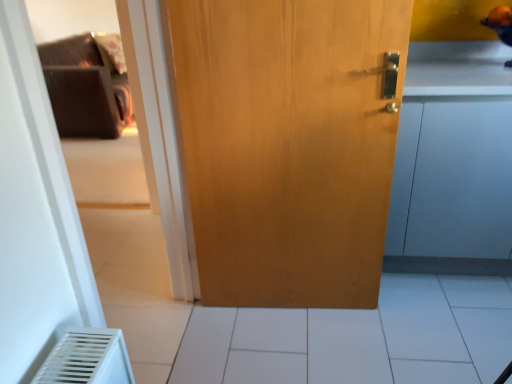
At what (x,y) coordinates should I click in order to perform the action: click on matte wood cabinet at right. Please return your answer as a coordinate pair (x, y). This screenshot has height=384, width=512. Looking at the image, I should click on (453, 162).

Identify the location of light brown wood door at center. The image size is (512, 384). click(289, 145).

Find the location of a particular element. This screenshot has width=512, height=384. tile below the matte wood cabinet at right (from the image's perspective) is located at coordinates (359, 337).

Which object is further away from the camera, white tile at center or matte wood cabinet at right?

matte wood cabinet at right is further away from the camera.

Between point (223, 376) and point (415, 138), which one is positioned behind?

The point (415, 138) is farther.

Between white tile at center and matte wood cabinet at right, which one has larger width?

Wider between the two is white tile at center.

From the image's perspective, which one is positioned lower, matte wood cabinet at right or white tile at center?

white tile at center.

Considering the relative sizes of matte wood cabinet at right and white tile at center in the image provided, is matte wood cabinet at right wider than white tile at center?

No, matte wood cabinet at right is not wider than white tile at center.

Which is closer, [497,268] or [358,380]?

Point [497,268] is farther from the camera than point [358,380].

From a real-world perspective, which object stands above the other?

matte wood cabinet at right, from a real-world perspective.

Locate an element on the screen. This screenshot has width=512, height=384. door lying below the matte wood cabinet at right (from the image's perspective) is located at coordinates (289, 145).

Which is more distant, (366, 54) or (409, 75)?

Positioned behind is point (409, 75).

Does light brown wood door at center turn towards matte wood cabinet at right?

No, light brown wood door at center does not turn towards matte wood cabinet at right.

How different are the orientations of light brown wood door at center and matte wood cabinet at right in degrees?

The facing directions of light brown wood door at center and matte wood cabinet at right are 5.28 degrees apart.

Is matte wood cabinet at right far away from light brown wood door at center?

matte wood cabinet at right is actually quite close to light brown wood door at center.

Can you confirm if matte wood cabinet at right is taller than light brown wood door at center?

In fact, matte wood cabinet at right may be shorter than light brown wood door at center.

How different are the orientations of matte wood cabinet at right and light brown wood door at center in degrees?

5.28 degrees separate the facing orientations of matte wood cabinet at right and light brown wood door at center.

Is matte wood cabinet at right wider than light brown wood door at center?

Correct, the width of matte wood cabinet at right exceeds that of light brown wood door at center.

Considering the positions of points (456, 286) and (281, 59), is point (456, 286) closer to camera compared to point (281, 59)?

No, (456, 286) is behind (281, 59).

In the scene shown: Is white tile at center shorter than light brown wood door at center?

Indeed, white tile at center has a lesser height compared to light brown wood door at center.

Choose the correct answer: Is white tile at center inside light brown wood door at center or outside it?

white tile at center exists outside the volume of light brown wood door at center.

Is light brown wood door at center looking in the opposite direction of white tile at center?

No, light brown wood door at center is not facing the opposite direction of white tile at center.

Locate an element on the screen. The width and height of the screenshot is (512, 384). tile below the light brown wood door at center (from the image's perspective) is located at coordinates (359, 337).

Between light brown wood door at center and white tile at center, which one is positioned behind?

white tile at center is further from the camera.

At what (x,y) coordinates should I click in order to perform the action: click on cabinetry located on the right of white tile at center. Please return your answer as a coordinate pair (x, y). Looking at the image, I should click on (453, 162).

You are a GUI agent. You are given a task and a screenshot of the screen. Output one action in this format:
    pyautogui.click(x=<x>, y=<y>)
    Task: Click on the tile on the left of matte wood cabinet at right
    The height and width of the screenshot is (384, 512).
    Given the screenshot: What is the action you would take?
    pyautogui.click(x=359, y=337)

Considering their positions, is white tile at center positioned closer to matte wood cabinet at right than light brown wood door at center?

light brown wood door at center lies closer to matte wood cabinet at right than the other object.

Which object lies nearer to the anchor point white tile at center, matte wood cabinet at right or light brown wood door at center?

Among the two, matte wood cabinet at right is located nearer to white tile at center.

Estimate the real-world distances between objects in this image. Which object is further from matte wood cabinet at right, light brown wood door at center or white tile at center?

The object further to matte wood cabinet at right is white tile at center.

From the picture: When comparing their distances from white tile at center, does light brown wood door at center or matte wood cabinet at right seem closer?

Among the two, matte wood cabinet at right is located nearer to white tile at center.

Looking at the image, which one is located closer to light brown wood door at center, white tile at center or matte wood cabinet at right?

Based on the image, matte wood cabinet at right appears to be nearer to light brown wood door at center.

Based on their spatial positions, is matte wood cabinet at right or white tile at center further from light brown wood door at center?

white tile at center lies further to light brown wood door at center than the other object.

Locate an element on the screen. tile located between light brown wood door at center and matte wood cabinet at right in the left-right direction is located at coordinates (359, 337).